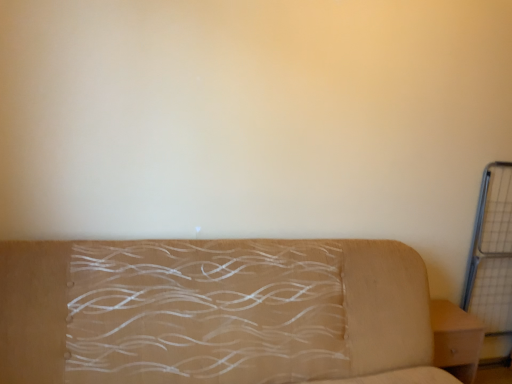
What do you see at coordinates (456, 339) in the screenshot?
I see `light brown wood nightstand at lower right` at bounding box center [456, 339].

This screenshot has height=384, width=512. What are the coordinates of `beige fabric couch at center` in the screenshot? It's located at (215, 312).

From their relative heights in the image, would you say metal grid at right is taller or shorter than beige fabric couch at center?

Considering their sizes, metal grid at right has more height than beige fabric couch at center.

Between metal grid at right and beige fabric couch at center, which one appears on the right side from the viewer's perspective?

metal grid at right is more to the right.

In the image, is metal grid at right positioned in front of or behind beige fabric couch at center?

Visually, metal grid at right is located behind beige fabric couch at center.

How much distance is there between metal grid at right and beige fabric couch at center?

→ metal grid at right and beige fabric couch at center are 4.11 feet apart.

Identify the location of furniture below the beige fabric couch at center (from the image's perspective). The height and width of the screenshot is (384, 512). (456, 339).

Between beige fabric couch at center and light brown wood nightstand at lower right, which one has larger width?

With larger width is beige fabric couch at center.

Can you tell me how much beige fabric couch at center and light brown wood nightstand at lower right differ in facing direction?

beige fabric couch at center and light brown wood nightstand at lower right are facing 0.74 degrees away from each other.

Is light brown wood nightstand at lower right turned away from beige fabric couch at center?

No, beige fabric couch at center is not at the back of light brown wood nightstand at lower right.

In the scene shown: Which object is further away from the camera taking this photo, light brown wood nightstand at lower right or beige fabric couch at center?

light brown wood nightstand at lower right is further away from the camera.

Is light brown wood nightstand at lower right shorter than beige fabric couch at center?

Indeed, light brown wood nightstand at lower right has a lesser height compared to beige fabric couch at center.

Is metal grid at right not close to light brown wood nightstand at lower right?

No, metal grid at right is not far away from light brown wood nightstand at lower right.

Is metal grid at right bigger than light brown wood nightstand at lower right?

Yes.

Is metal grid at right spatially inside light brown wood nightstand at lower right, or outside of it?

metal grid at right is outside light brown wood nightstand at lower right.

Which of these two, metal grid at right or light brown wood nightstand at lower right, is thinner?

metal grid at right.

Is point (367, 341) closer or farther from the camera than point (486, 283)?

Point (367, 341).

Which object is wider, beige fabric couch at center or metal grid at right?

With larger width is beige fabric couch at center.

Consider the image. From a real-world perspective, which object stands above the other?

metal grid at right.

Consider the image. Is beige fabric couch at center spatially inside metal grid at right, or outside of it?

beige fabric couch at center is not enclosed by metal grid at right.

Is point (468, 377) positioned after point (489, 168)?

No, (468, 377) is in front of (489, 168).

From the image's perspective, is light brown wood nightstand at lower right above or below metal grid at right?

From the image's perspective, light brown wood nightstand at lower right appears below metal grid at right.

In the image, there is a metal grid at right. Identify the location of furniture below it (from a real-world perspective). (456, 339).

You are a GUI agent. You are given a task and a screenshot of the screen. Output one action in this format:
    pyautogui.click(x=<x>, y=<y>)
    Task: Click on the cage above the beige fabric couch at center (from a real-world perspective)
    This screenshot has height=384, width=512.
    Given the screenshot: What is the action you would take?
    pyautogui.click(x=492, y=253)

This screenshot has width=512, height=384. I want to click on furniture that appears below the beige fabric couch at center (from a real-world perspective), so click(456, 339).

Considering their positions, is beige fabric couch at center positioned further to metal grid at right than light brown wood nightstand at lower right?

The object further to metal grid at right is beige fabric couch at center.

Considering their positions, is metal grid at right positioned closer to beige fabric couch at center than light brown wood nightstand at lower right?

light brown wood nightstand at lower right.

Looking at the image, which one is located further to light brown wood nightstand at lower right, beige fabric couch at center or metal grid at right?

Based on the image, beige fabric couch at center appears to be further to light brown wood nightstand at lower right.

Considering their positions, is light brown wood nightstand at lower right positioned closer to metal grid at right than beige fabric couch at center?

Among the two, light brown wood nightstand at lower right is located nearer to metal grid at right.

Looking at the image, which one is located closer to beige fabric couch at center, light brown wood nightstand at lower right or metal grid at right?

light brown wood nightstand at lower right.

Which object lies further to the anchor point light brown wood nightstand at lower right, metal grid at right or beige fabric couch at center?

beige fabric couch at center lies further to light brown wood nightstand at lower right than the other object.

I want to click on furniture between beige fabric couch at center and metal grid at right from front to back, so click(456, 339).